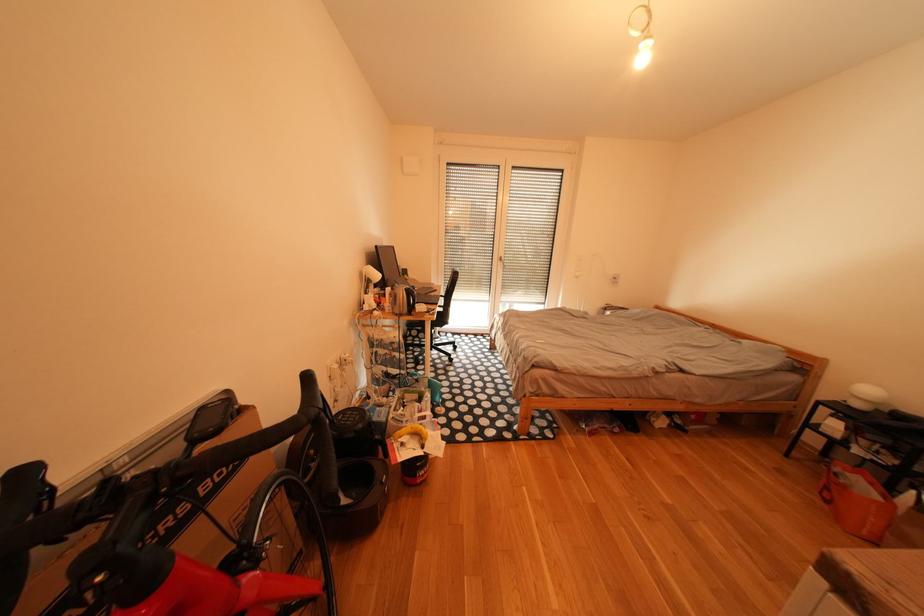
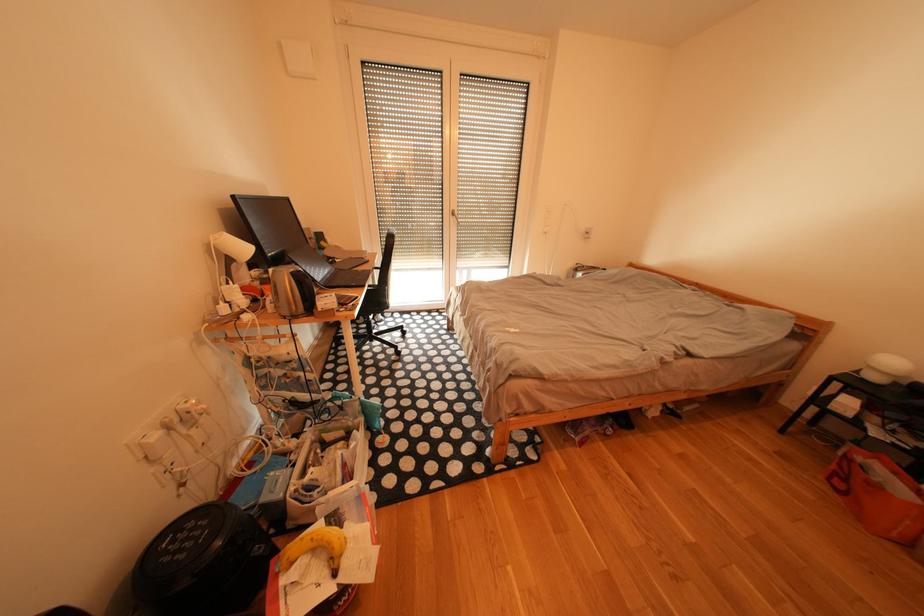
Question: The images are taken continuously from a first-person perspective. In which direction is your viewpoint rotating?

Choices:
 (A) Left
 (B) Right
 (C) Up
 (D) Down

Answer: (D)